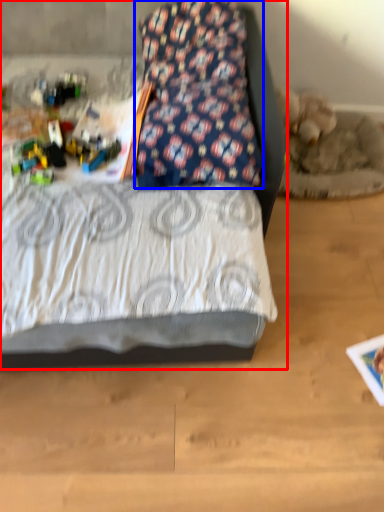
Question: Which point is further to the camera, bed (highlighted by a red box) or pillow (highlighted by a blue box)?

Choices:
 (A) bed
 (B) pillow

Answer: (B)